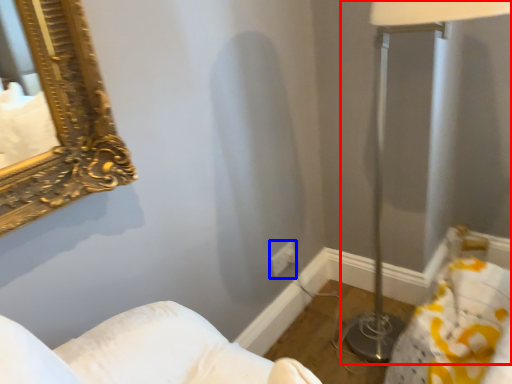
Question: Which of the following is the farthest to the observer, table lamp (highlighted by a red box) or electric outlet (highlighted by a blue box)?

Choices:
 (A) table lamp
 (B) electric outlet

Answer: (B)